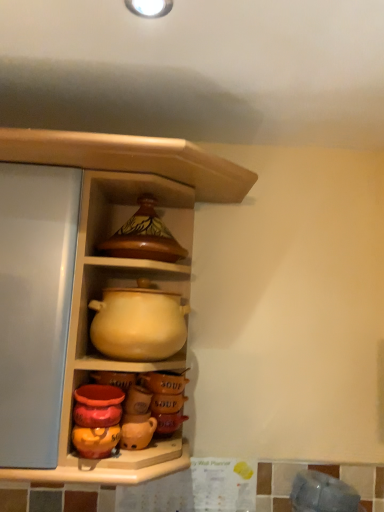
Question: From the image's perspective, is matte yellow clay pot at center above matte ceramic pot at upper center?

Choices:
 (A) yes
 (B) no

Answer: (B)

Question: Considering the relative sizes of matte yellow clay pot at center and matte ceramic pot at upper center in the image provided, is matte yellow clay pot at center shorter than matte ceramic pot at upper center?

Choices:
 (A) no
 (B) yes

Answer: (B)

Question: From the image's perspective, is matte yellow clay pot at center below matte ceramic pot at upper center?

Choices:
 (A) no
 (B) yes

Answer: (B)

Question: Can you confirm if matte yellow clay pot at center is wider than matte ceramic pot at upper center?

Choices:
 (A) yes
 (B) no

Answer: (B)

Question: Is matte yellow clay pot at center outside of matte ceramic pot at upper center?

Choices:
 (A) no
 (B) yes

Answer: (A)

Question: From the image's perspective, is matte ceramic pot at upper center positioned above or below matte yellow clay pot at center?

Choices:
 (A) below
 (B) above

Answer: (B)

Question: Is matte ceramic pot at upper center bigger or smaller than matte yellow clay pot at center?

Choices:
 (A) big
 (B) small

Answer: (A)

Question: In the image, is matte ceramic pot at upper center positioned in front of or behind matte yellow clay pot at center?

Choices:
 (A) front
 (B) behind

Answer: (A)

Question: Considering the positions of matte ceramic pot at upper center and matte yellow clay pot at center in the image, is matte ceramic pot at upper center taller or shorter than matte yellow clay pot at center?

Choices:
 (A) short
 (B) tall

Answer: (B)

Question: From the image's perspective, is matte yellow clay pot at center positioned above or below matte ceramic pot at upper center?

Choices:
 (A) above
 (B) below

Answer: (B)

Question: Based on their positions, is matte yellow clay pot at center located to the left or right of matte ceramic pot at upper center?

Choices:
 (A) right
 (B) left

Answer: (B)

Question: Is matte yellow clay pot at center taller or shorter than matte ceramic pot at upper center?

Choices:
 (A) short
 (B) tall

Answer: (A)

Question: Looking at the image, does matte yellow clay pot at center seem bigger or smaller compared to matte ceramic pot at upper center?

Choices:
 (A) small
 (B) big

Answer: (A)

Question: Considering their positions, is brown glossy pot at upper center located in front of or behind matte ceramic pot at upper center?

Choices:
 (A) behind
 (B) front

Answer: (A)

Question: Is brown glossy pot at upper center to the left or to the right of matte ceramic pot at upper center in the image?

Choices:
 (A) left
 (B) right

Answer: (A)